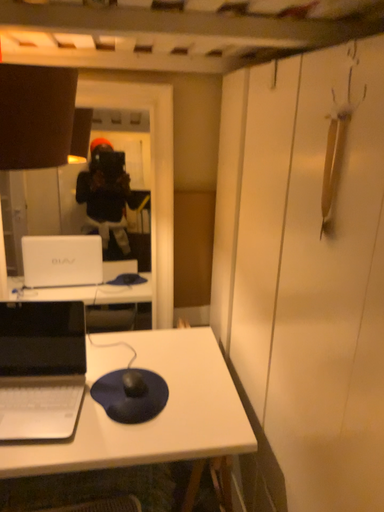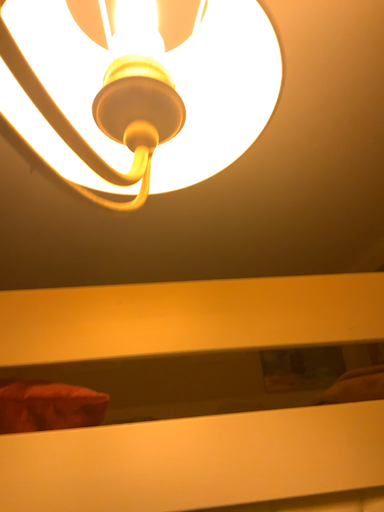
Question: Which way did the camera rotate in the video?

Choices:
 (A) rotated upward
 (B) rotated downward

Answer: (A)